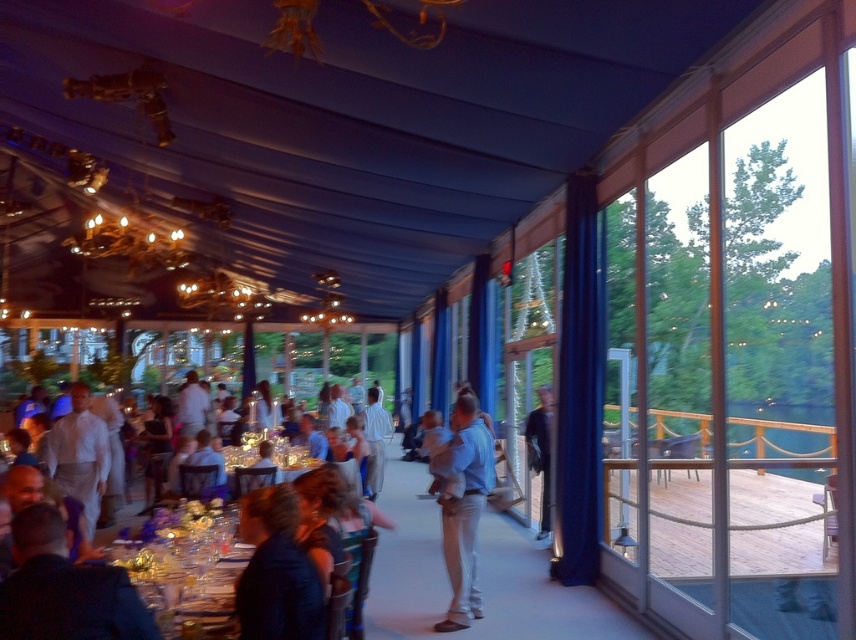
You are standing in the event space and want to take a photo of the dark blue fabric at center and the white cotton shirt at center. Which object should you focus on first to ensure both are in focus?

The dark blue fabric at center is closer to the viewer than the white cotton shirt at center. To ensure both are in focus, you should focus on the dark blue fabric at center first, as it is the closer object.

You are standing at the center of the event space and want to take a photo. There are two points marked in the image, point 1 at coordinates point (x=242, y=525) and point 2 at coordinates point (x=66, y=460). Which point will appear larger in your camera view?

Point 1 at coordinates point (x=242, y=525) will appear larger in the camera view because it is closer to the camera than point 2 at coordinates point (x=66, y=460).